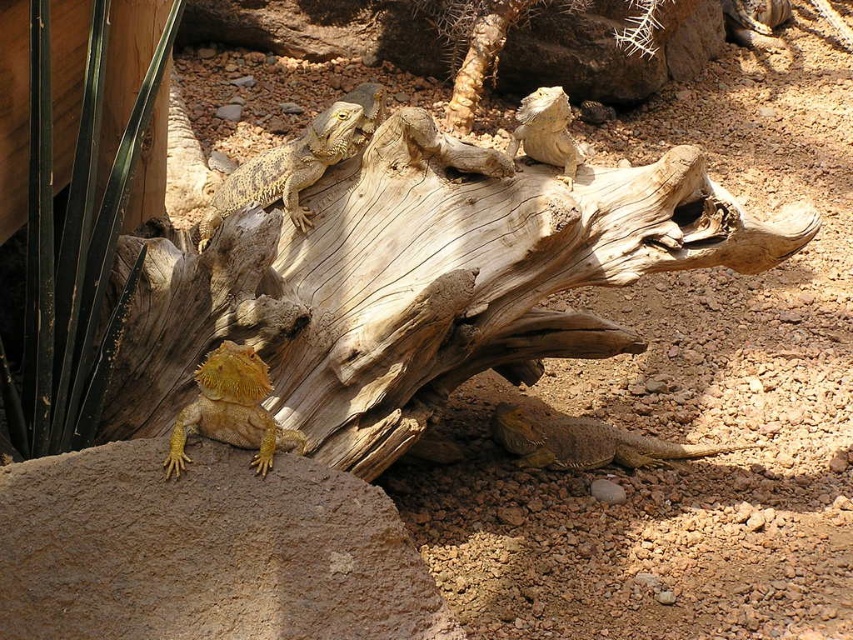
Looking at this image, is yellowish-brown scaly lizard at lower right positioned behind beige scaly lizard at upper center?

Yes, yellowish-brown scaly lizard at lower right is behind beige scaly lizard at upper center.

Which is more to the left, yellowish-brown scaly lizard at lower right or beige scaly lizard at upper center?

beige scaly lizard at upper center is more to the left.

Between point (573, 433) and point (560, 120), which one is positioned in front?

Point (560, 120) is in front.

Where is `yellowish-brown scaly lizard at lower right`? The height and width of the screenshot is (640, 853). yellowish-brown scaly lizard at lower right is located at coordinates (581, 440).

Does point (323, 140) come in front of point (244, 392)?

That is False.

Which is below, yellowish scaly lizard at upper center or yellow scaly lizard at lower left?

Positioned lower is yellow scaly lizard at lower left.

Does point (253, 156) come in front of point (250, 352)?

No, it is behind (250, 352).

The width and height of the screenshot is (853, 640). Find the location of `yellowish scaly lizard at upper center`. yellowish scaly lizard at upper center is located at coordinates (293, 164).

Is yellow scaly lizard at lower left shorter than yellowish-brown scaly lizard at lower right?

In fact, yellow scaly lizard at lower left may be taller than yellowish-brown scaly lizard at lower right.

Who is more distant from viewer, (230, 372) or (686, 451)?

Point (686, 451)

You are a GUI agent. You are given a task and a screenshot of the screen. Output one action in this format:
    pyautogui.click(x=<x>, y=<y>)
    Task: Click on the yellow scaly lizard at lower left
    This screenshot has height=640, width=853.
    Given the screenshot: What is the action you would take?
    pyautogui.click(x=231, y=410)

This screenshot has width=853, height=640. I want to click on yellow scaly lizard at lower left, so click(x=231, y=410).